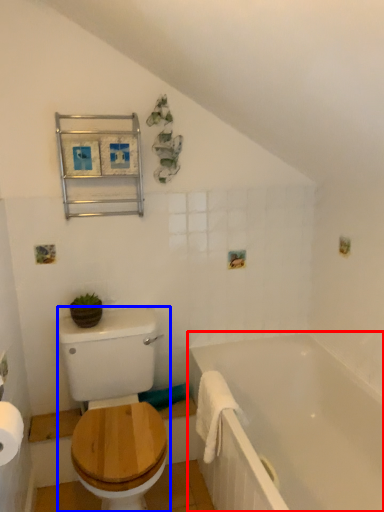
Question: Among these objects, which one is nearest to the camera, bathtub (highlighted by a red box) or sit (highlighted by a blue box)?

Choices:
 (A) bathtub
 (B) sit

Answer: (A)